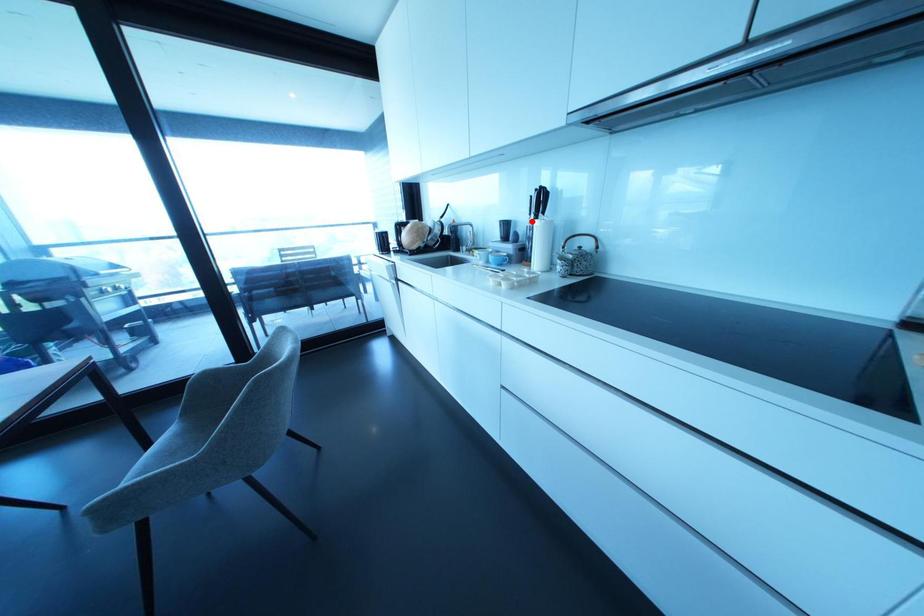
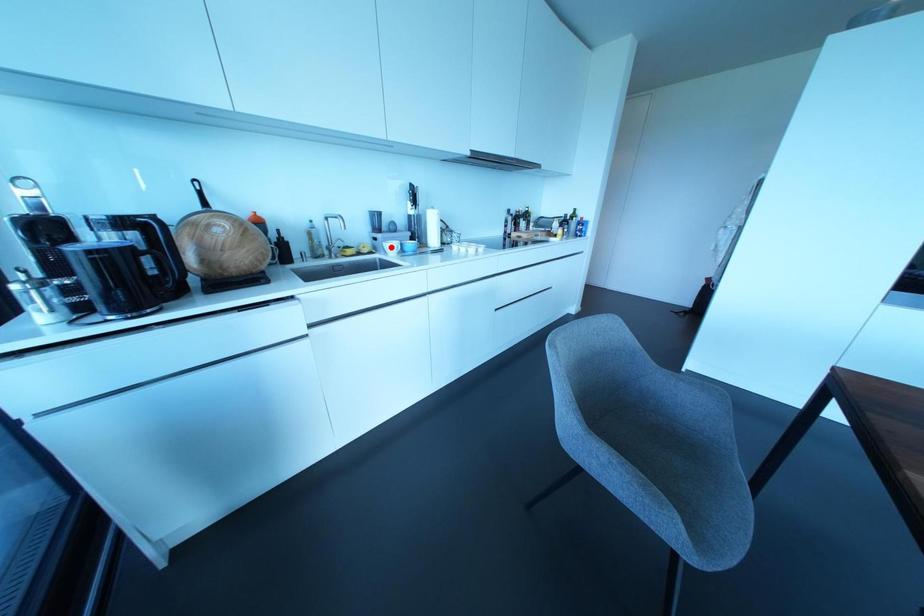
I am providing you with two images of the same scene from different viewpoints. A red point is marked on the first image and another point is marked on the second image. Do the highlighted points in image1 and image2 indicate the same real-world spot?

No